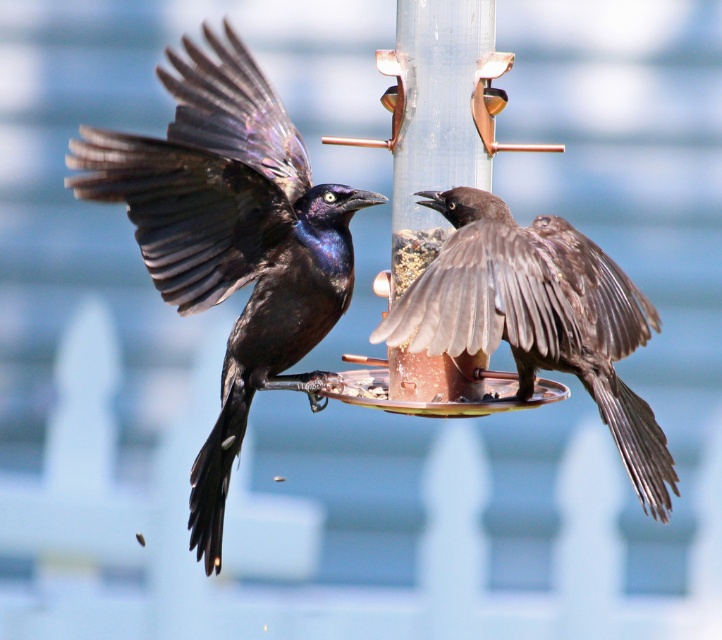
Question: In this image, where is shiny black wing at upper left located relative to copper metallic pole at center?

Choices:
 (A) left
 (B) right

Answer: (A)

Question: Which point is closer to the camera?

Choices:
 (A) shiny black bird at left
 (B) brown matte bird at center
 (C) copper metallic pole at center

Answer: (B)

Question: Which object is farther from the camera taking this photo?

Choices:
 (A) brown matte bird at center
 (B) copper metallic pole at center

Answer: (B)

Question: Is shiny black bird at left above copper metallic pole at center?

Choices:
 (A) no
 (B) yes

Answer: (B)

Question: Which object is farther from the camera taking this photo?

Choices:
 (A) shiny black wing at upper left
 (B) brown matte bird at center
 (C) shiny black bird at left
 (D) copper metallic pole at center

Answer: (D)

Question: From the image, what is the correct spatial relationship of brown matte bird at center in relation to copper metallic pole at center?

Choices:
 (A) left
 (B) right

Answer: (B)